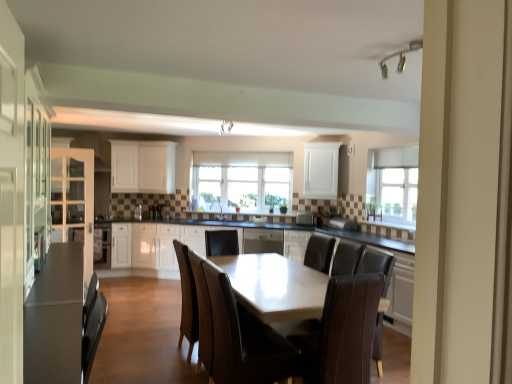
Question: Can you confirm if white matte cabinet at upper center, the 5th cabinetry positioned from the left, is taller than matte gray armchair at center?

Choices:
 (A) no
 (B) yes

Answer: (B)

Question: Is white matte cabinet at upper center, the first cabinetry in the right-to-left sequence, not near matte gray armchair at center?

Choices:
 (A) yes
 (B) no

Answer: (B)

Question: Is matte gray armchair at center located within white matte cabinet at upper center, the 5th cabinetry positioned from the left?

Choices:
 (A) no
 (B) yes

Answer: (A)

Question: From a real-world perspective, is white matte cabinet at upper center, the 5th cabinetry positioned from the left, positioned over matte gray armchair at center based on gravity?

Choices:
 (A) no
 (B) yes

Answer: (B)

Question: Is white matte cabinet at upper center, the 5th cabinetry positioned from the left, positioned with its back to matte gray armchair at center?

Choices:
 (A) no
 (B) yes

Answer: (A)

Question: From the image's perspective, is white matte cabinet at upper center, the 5th cabinetry positioned from the left, located above matte gray armchair at center?

Choices:
 (A) yes
 (B) no

Answer: (A)

Question: Can we say satin silver toaster at center, the first appliance in the right-to-left sequence, lies outside brown leather chair at center, positioned as the 2th chair in left-to-right order?

Choices:
 (A) no
 (B) yes

Answer: (B)

Question: Does satin silver toaster at center, the first appliance in the right-to-left sequence, lie in front of brown leather chair at center, positioned as the 2th chair in left-to-right order?

Choices:
 (A) yes
 (B) no

Answer: (B)

Question: Does satin silver toaster at center, which is the 2th appliance in left-to-right order, lie behind brown leather chair at center, positioned as the 2th chair in left-to-right order?

Choices:
 (A) no
 (B) yes

Answer: (B)

Question: Can you confirm if satin silver toaster at center, the first appliance in the right-to-left sequence, is wider than brown leather chair at center, positioned as the 2th chair in left-to-right order?

Choices:
 (A) no
 (B) yes

Answer: (A)

Question: Does satin silver toaster at center, the first appliance in the right-to-left sequence, contain brown leather chair at center, which is the 1th chair in right-to-left order?

Choices:
 (A) no
 (B) yes

Answer: (A)

Question: Is satin silver toaster at center, which is the 2th appliance in left-to-right order, thinner than brown leather chair at center, positioned as the 2th chair in left-to-right order?

Choices:
 (A) no
 (B) yes

Answer: (B)

Question: Can you confirm if matte white cabinet at left, marked as the 5th cabinetry in a right-to-left arrangement, is thinner than matte white table at center?

Choices:
 (A) yes
 (B) no

Answer: (A)